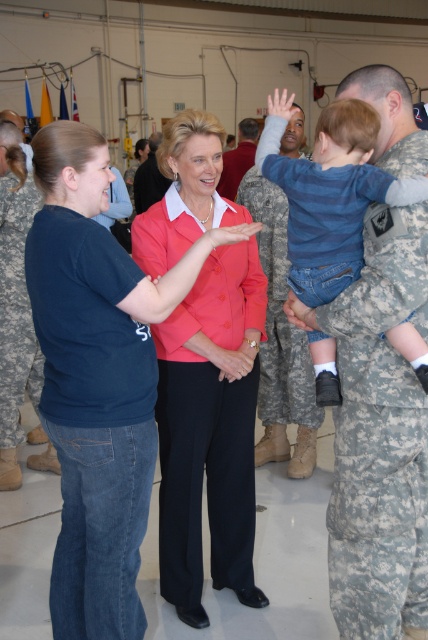
Is point (262, 314) in front of point (14, 435)?

Yes, point (262, 314) is in front of point (14, 435).

Which is below, matte pink blazer at center or blue camouflage uniform at lower left?

matte pink blazer at center

Identify the location of matte pink blazer at center. This screenshot has width=428, height=640. (210, 429).

Can you confirm if camouflage fabric uniform at right is positioned below blue denim jeans at center?

Indeed, camouflage fabric uniform at right is positioned under blue denim jeans at center.

Who is positioned more to the left, camouflage fabric uniform at right or blue denim jeans at center?

From the viewer's perspective, blue denim jeans at center appears more on the left side.

Describe the element at coordinates (380, 435) in the screenshot. The height and width of the screenshot is (640, 428). I see `camouflage fabric uniform at right` at that location.

Image resolution: width=428 pixels, height=640 pixels. I want to click on camouflage fabric uniform at right, so click(x=380, y=435).

Is point (234, 264) positioned behind point (382, 460)?

Yes, it is.

Where is `matte pink blazer at center`? The height and width of the screenshot is (640, 428). matte pink blazer at center is located at coordinates (210, 429).